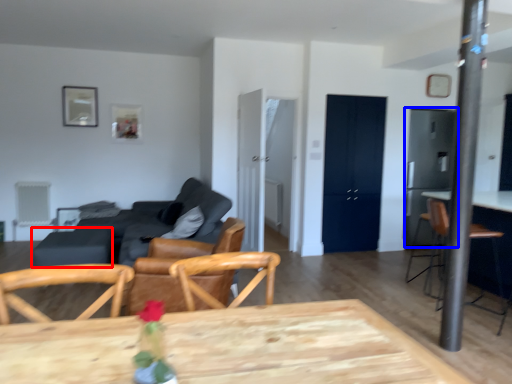
Question: Which point is further to the camera, table (highlighted by a red box) or appliance (highlighted by a blue box)?

Choices:
 (A) table
 (B) appliance

Answer: (B)